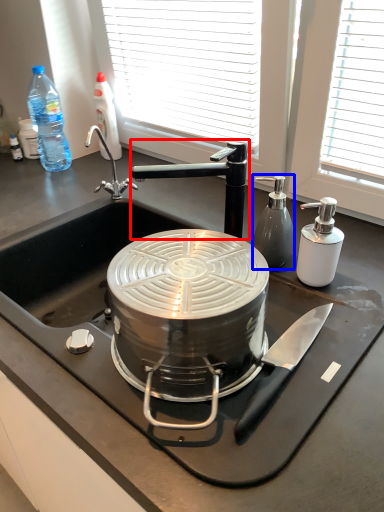
Question: Which of the following is the closest to the observer, tap (highlighted by a red box) or bottle (highlighted by a blue box)?

Choices:
 (A) tap
 (B) bottle

Answer: (A)